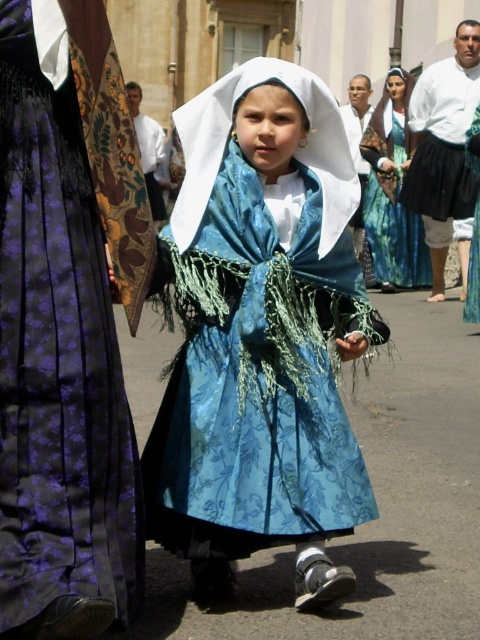
Question: Is blue textured fabric dress at center behind blue silk dress at center?

Choices:
 (A) yes
 (B) no

Answer: (A)

Question: Is blue fabric dress at center positioned in front of blue satin dress at center?

Choices:
 (A) yes
 (B) no

Answer: (A)

Question: Which object is farther from the camera taking this photo?

Choices:
 (A) blue fabric dress at center
 (B) matte purple skirt at left

Answer: (A)

Question: Which point is closer to the camera taking this photo?

Choices:
 (A) (361, 188)
 (B) (324, 211)
 (C) (469, 164)

Answer: (B)

Question: Which object is closer to the camera taking this photo?

Choices:
 (A) white cotton shirt at upper right
 (B) blue silk dress at center
 (C) matte purple skirt at left

Answer: (C)

Question: Does matte purple skirt at left appear over blue textured fabric dress at center?

Choices:
 (A) no
 (B) yes

Answer: (A)